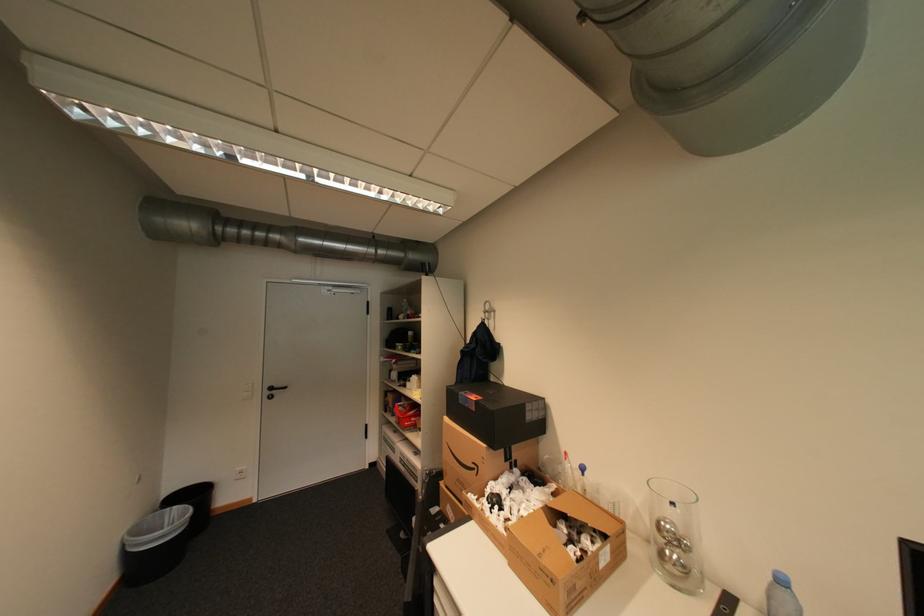
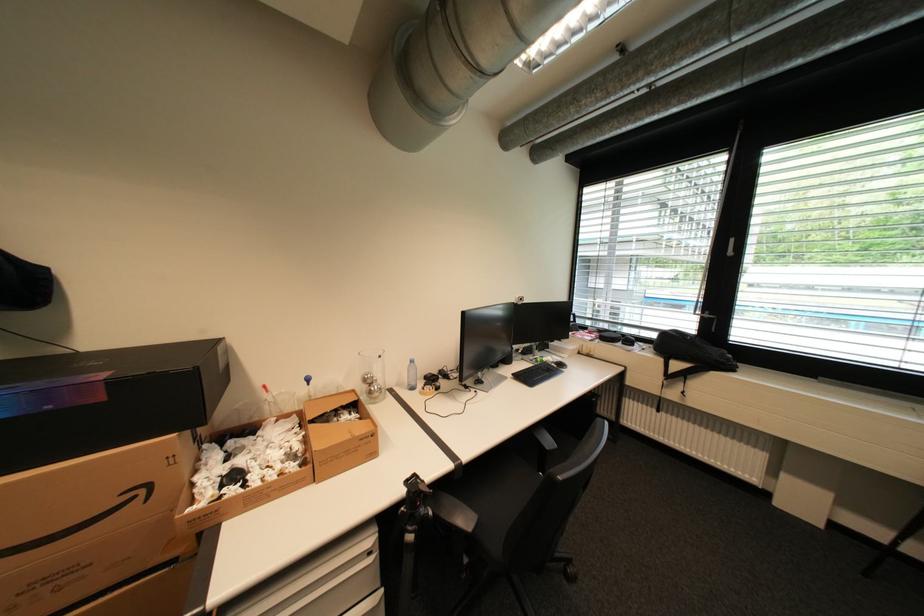
Find the pixel in the second image that matches pixel 673 527 in the first image.

(377, 378)